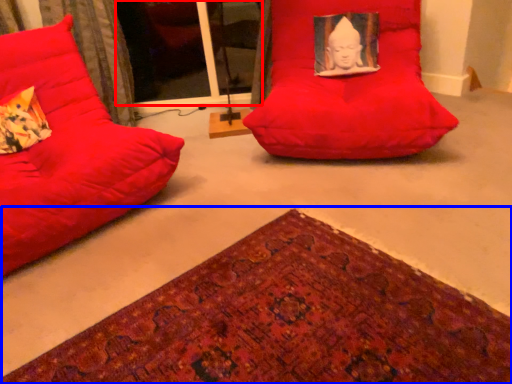
Question: Which object is closer to the camera taking this photo, glass door (highlighted by a red box) or mat (highlighted by a blue box)?

Choices:
 (A) glass door
 (B) mat

Answer: (B)